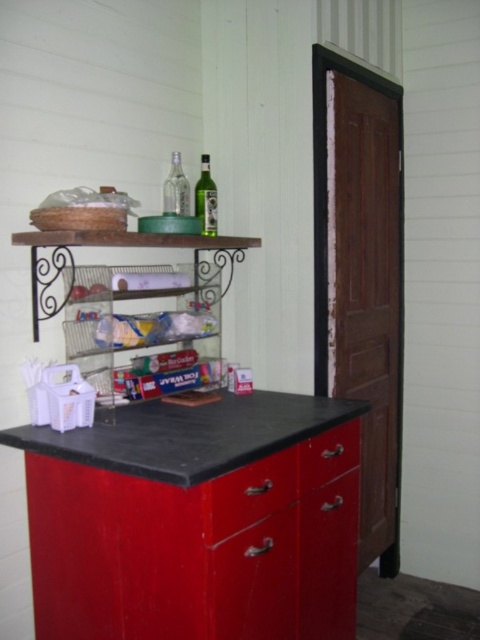
Does metallic wire shelf at upper left have a greater height compared to green glass bottle at upper center?

Yes, metallic wire shelf at upper left is taller than green glass bottle at upper center.

The width and height of the screenshot is (480, 640). Describe the element at coordinates (129, 298) in the screenshot. I see `metallic wire shelf at upper left` at that location.

Identify the location of metallic wire shelf at upper left. The image size is (480, 640). (129, 298).

Is matte red drawer at center positioned at the back of green glass bottle at upper center?

No, matte red drawer at center is in front of green glass bottle at upper center.

Can you confirm if matte red drawer at center is bigger than green glass bottle at upper center?

Indeed, matte red drawer at center has a larger size compared to green glass bottle at upper center.

Locate an element on the screen. The image size is (480, 640). matte red drawer at center is located at coordinates (327, 456).

Measure the distance from metallic red drawer at lower center to green glass bottle at upper center.

metallic red drawer at lower center is 3.42 feet away from green glass bottle at upper center.

Does metallic red drawer at lower center have a smaller size compared to green glass bottle at upper center?

Actually, metallic red drawer at lower center might be larger than green glass bottle at upper center.

Locate an element on the screen. metallic red drawer at lower center is located at coordinates (248, 493).